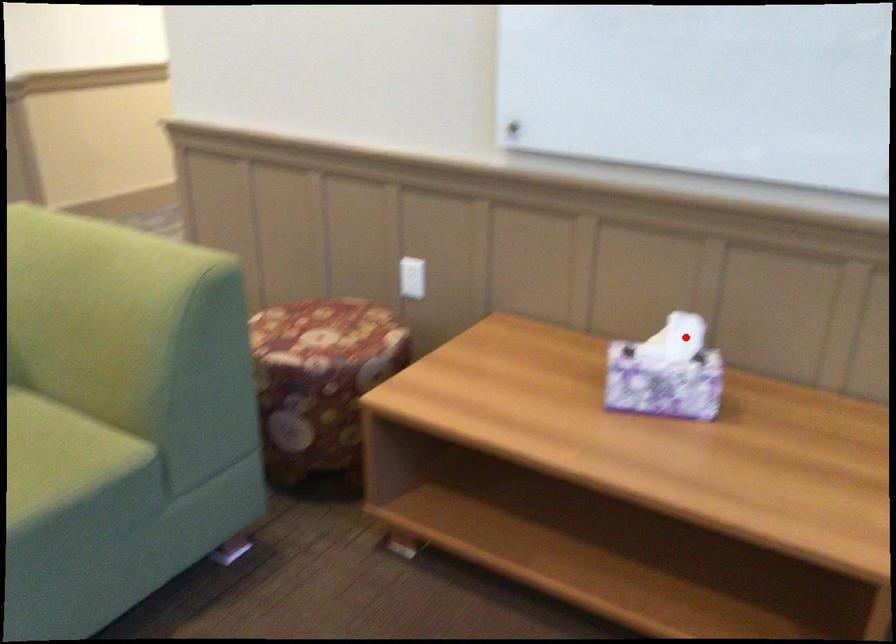
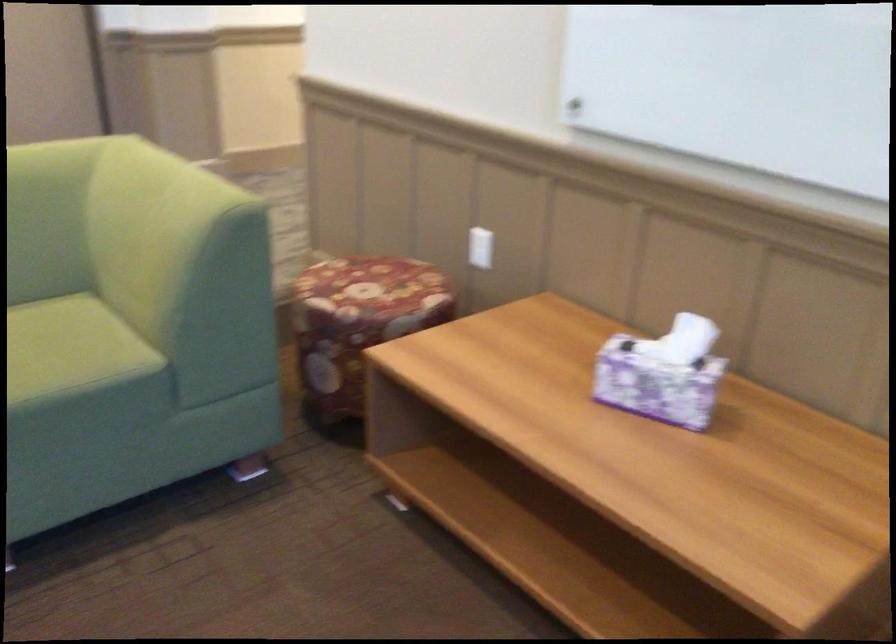
In the second image, find the point that corresponds to the highlighted location in the first image.

(690, 341)